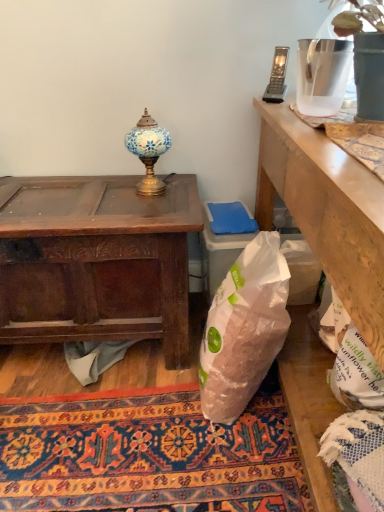
Find the location of a particular element. This screenshot has width=384, height=512. free point above dark brown wood desk at left (from a real-world perspective) is located at coordinates (77, 204).